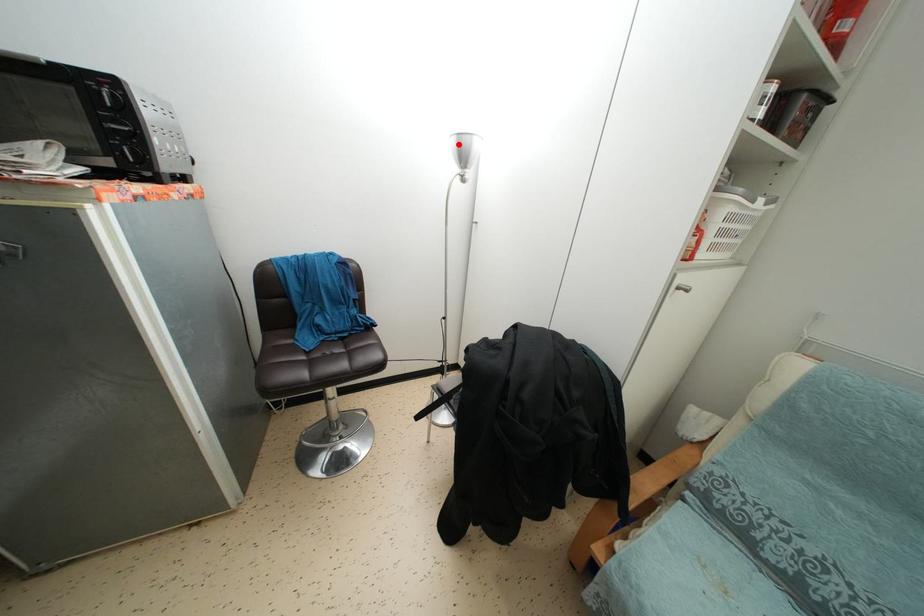
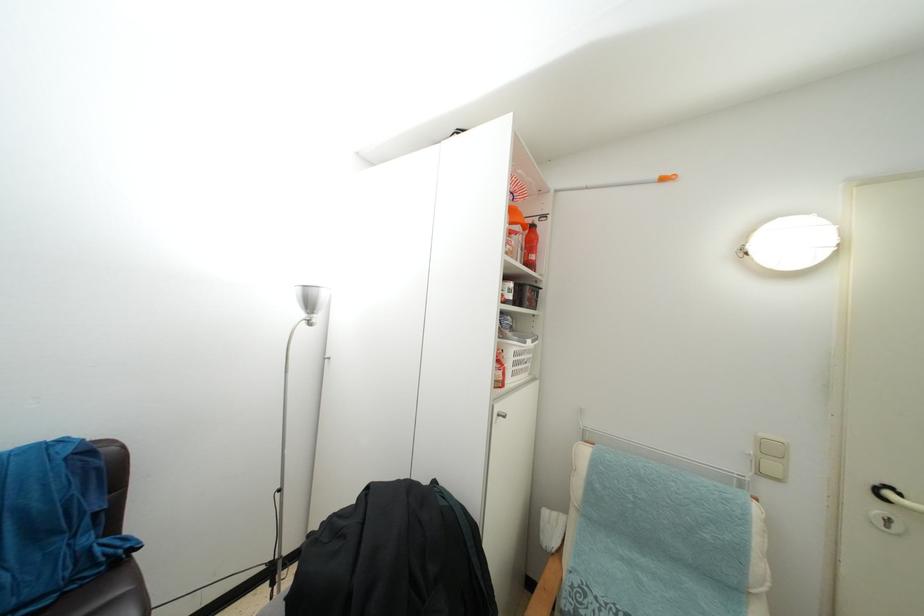
Find the pixel in the second image that matches the highlighted location in the first image.

(304, 294)